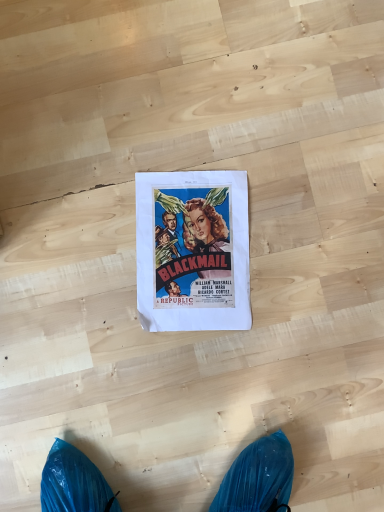
This screenshot has width=384, height=512. I want to click on free point to the left of matte paper poster at center, so click(x=79, y=253).